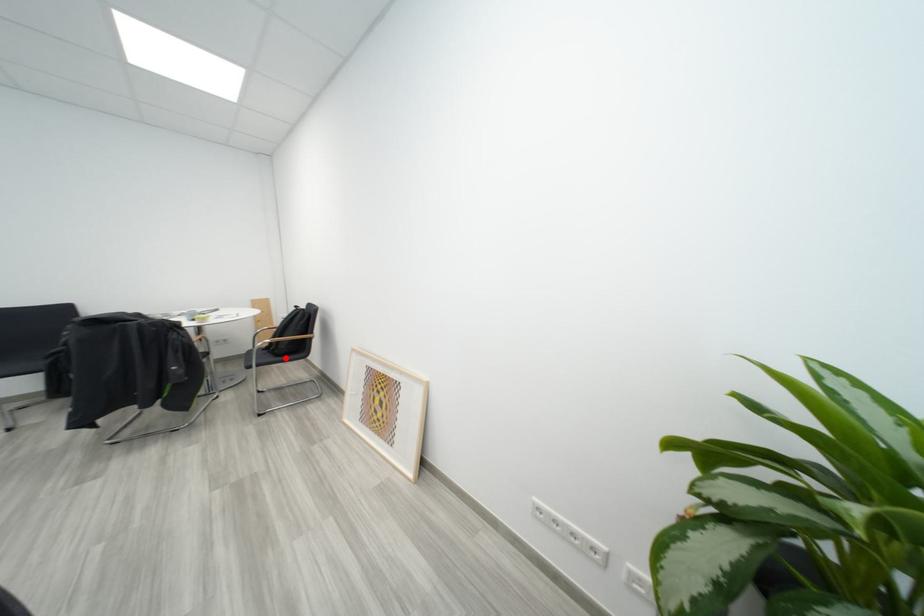
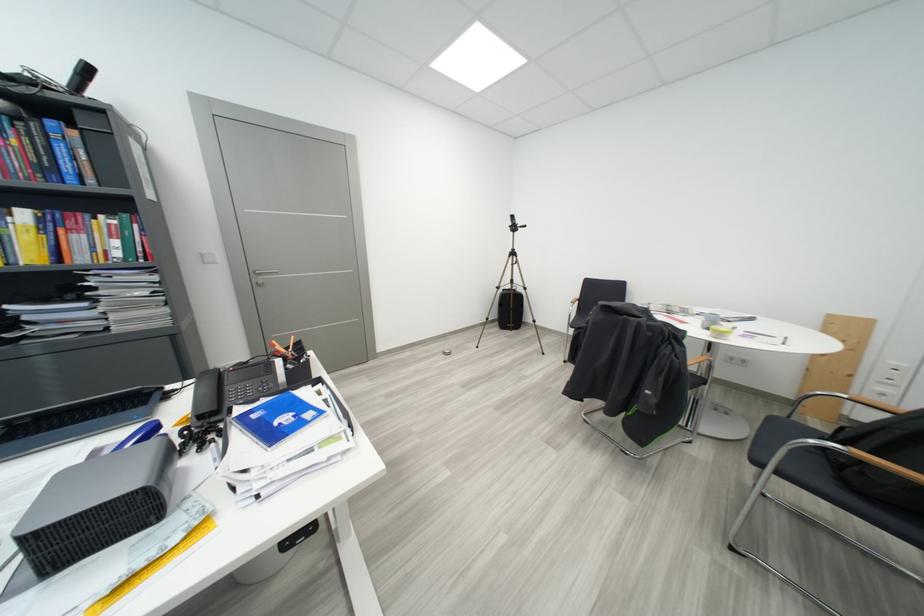
Locate, in the second image, the point that corresponds to the highlighted location in the first image.

(856, 487)